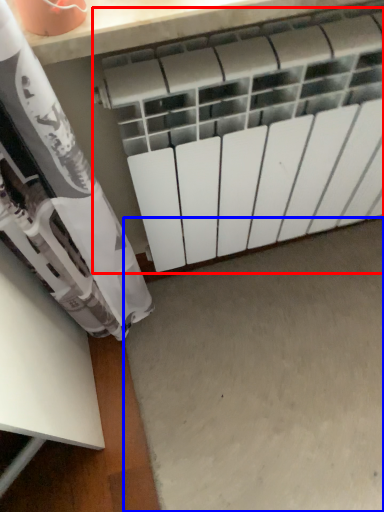
Question: Which object is further to the camera taking this photo, radiator (highlighted by a red box) or concrete (highlighted by a blue box)?

Choices:
 (A) radiator
 (B) concrete

Answer: (B)